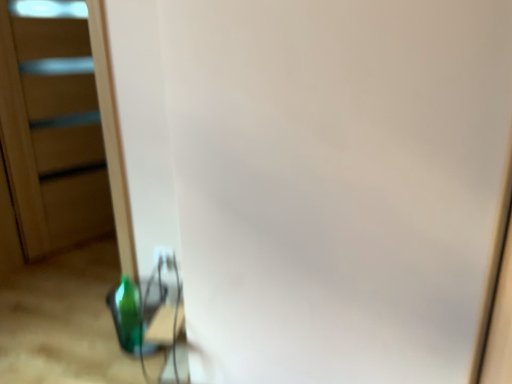
Measure the distance between white plastic electric outlet at lower center and camera.

white plastic electric outlet at lower center and camera are 5.88 feet apart from each other.

Where is `white plastic electric outlet at lower center`? white plastic electric outlet at lower center is located at coordinates (164, 258).

Does green glass bottle at lower left come behind white plastic electric outlet at lower center?

No, green glass bottle at lower left is closer to the viewer.

Based on the photo, could white plastic electric outlet at lower center be considered to be inside green glass bottle at lower left?

Definitely not — white plastic electric outlet at lower center is not inside green glass bottle at lower left.

Is green glass bottle at lower left at the right side of white plastic electric outlet at lower center?

In fact, green glass bottle at lower left is to the left of white plastic electric outlet at lower center.

In terms of size, does transparent plastic screen door at left appear bigger or smaller than green glass bottle at lower left?

Considering their sizes, transparent plastic screen door at left takes up more space than green glass bottle at lower left.

Is transparent plastic screen door at left not near green glass bottle at lower left?

Actually, transparent plastic screen door at left and green glass bottle at lower left are a little close together.

How many degrees apart are the facing directions of transparent plastic screen door at left and green glass bottle at lower left?

The angle between the facing direction of transparent plastic screen door at left and the facing direction of green glass bottle at lower left is 151 degrees.

The image size is (512, 384). I want to click on screen door above the green glass bottle at lower left (from a real-world perspective), so click(52, 134).

In the image, is green glass bottle at lower left on the left side or the right side of transparent plastic screen door at left?

Based on their positions, green glass bottle at lower left is located to the right of transparent plastic screen door at left.

Considering the relative sizes of green glass bottle at lower left and transparent plastic screen door at left in the image provided, is green glass bottle at lower left shorter than transparent plastic screen door at left?

Yes.

Is point (123, 279) more distant than point (5, 94)?

No, it is not.

From the image's perspective, which is above, white plastic electric outlet at lower center or green glass bottle at lower left?

white plastic electric outlet at lower center appears higher in the image.

Which point is more distant from viewer, (169, 268) or (126, 326)?

The point (169, 268) is behind.

Is white plastic electric outlet at lower center located outside green glass bottle at lower left?

Indeed, white plastic electric outlet at lower center is completely outside green glass bottle at lower left.

Is white plastic electric outlet at lower center smaller than green glass bottle at lower left?

Yes, white plastic electric outlet at lower center is smaller than green glass bottle at lower left.

Is white plastic electric outlet at lower center far from transparent plastic screen door at left?

Absolutely, white plastic electric outlet at lower center is distant from transparent plastic screen door at left.

Is transparent plastic screen door at left inside white plastic electric outlet at lower center?

That's incorrect, transparent plastic screen door at left is not inside white plastic electric outlet at lower center.

Is transparent plastic screen door at left next to white plastic electric outlet at lower center?

transparent plastic screen door at left and white plastic electric outlet at lower center are clearly separated.

This screenshot has width=512, height=384. In order to click on electric outlet below the transparent plastic screen door at left (from the image's perspective) in this screenshot , I will do `click(164, 258)`.

Is transparent plastic screen door at left further to camera compared to white plastic electric outlet at lower center?

Yes, transparent plastic screen door at left is further from the camera.

From the image's perspective, between transparent plastic screen door at left and white plastic electric outlet at lower center, who is located below?

white plastic electric outlet at lower center appears lower in the image.

Identify the location of bottle on the left of white plastic electric outlet at lower center. Image resolution: width=512 pixels, height=384 pixels. (126, 314).

The height and width of the screenshot is (384, 512). I want to click on bottle that appears below the transparent plastic screen door at left (from a real-world perspective), so tap(126, 314).

Looking at this image, which object lies nearer to the anchor point transparent plastic screen door at left, white plastic electric outlet at lower center or green glass bottle at lower left?

green glass bottle at lower left is closer to transparent plastic screen door at left.

Based on their spatial positions, is green glass bottle at lower left or white plastic electric outlet at lower center further from transparent plastic screen door at left?

white plastic electric outlet at lower center is positioned further to the anchor transparent plastic screen door at left.

Based on their spatial positions, is green glass bottle at lower left or transparent plastic screen door at left closer to white plastic electric outlet at lower center?

green glass bottle at lower left is closer to white plastic electric outlet at lower center.

Looking at this image, estimate the real-world distances between objects in this image. Which object is further from white plastic electric outlet at lower center, transparent plastic screen door at left or green glass bottle at lower left?

Among the two, transparent plastic screen door at left is located further to white plastic electric outlet at lower center.

Considering their positions, is transparent plastic screen door at left positioned closer to green glass bottle at lower left than white plastic electric outlet at lower center?

Based on the image, white plastic electric outlet at lower center appears to be nearer to green glass bottle at lower left.

Estimate the real-world distances between objects in this image. Which object is further from green glass bottle at lower left, white plastic electric outlet at lower center or transparent plastic screen door at left?

transparent plastic screen door at left is positioned further to the anchor green glass bottle at lower left.

In order to click on electric outlet between transparent plastic screen door at left and green glass bottle at lower left in the up-down direction in this screenshot , I will do `click(164, 258)`.